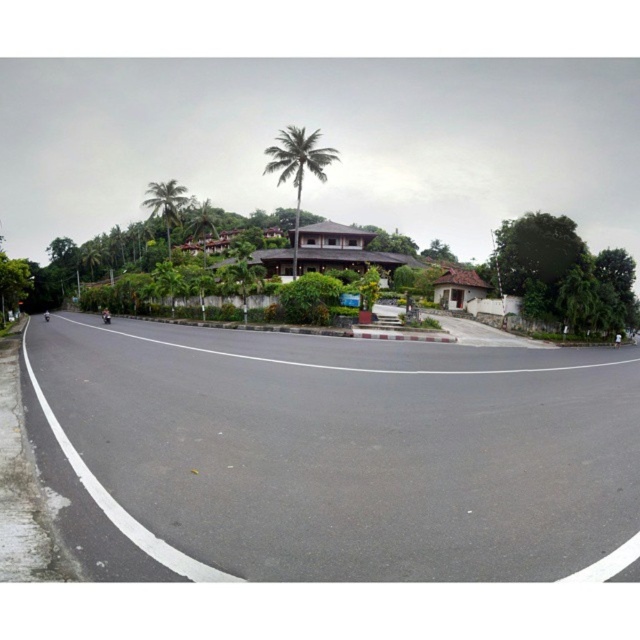
Based on the photo, is black asphalt road at lower left above green leafy palm tree at upper center?

Incorrect, black asphalt road at lower left is not positioned above green leafy palm tree at upper center.

Who is more forward, (150, 541) or (150, 196)?

Positioned in front is point (150, 541).

Locate an element on the screen. The height and width of the screenshot is (640, 640). black asphalt road at lower left is located at coordinates (116, 502).

From the picture: Which is more to the right, green leafy palm tree at center or green leafy palm tree at upper center?

Positioned to the right is green leafy palm tree at center.

Does green leafy palm tree at center lie behind green leafy palm tree at upper center?

No, green leafy palm tree at center is closer to the viewer.

This screenshot has height=640, width=640. Identify the location of green leafy palm tree at center. tap(298, 168).

Who is higher up, black asphalt road at lower left or green leafy palm tree at center?

green leafy palm tree at center is above.

Does black asphalt road at lower left appear on the right side of green leafy palm tree at center?

Yes, black asphalt road at lower left is to the right of green leafy palm tree at center.

Identify the location of black asphalt road at lower left. (116, 502).